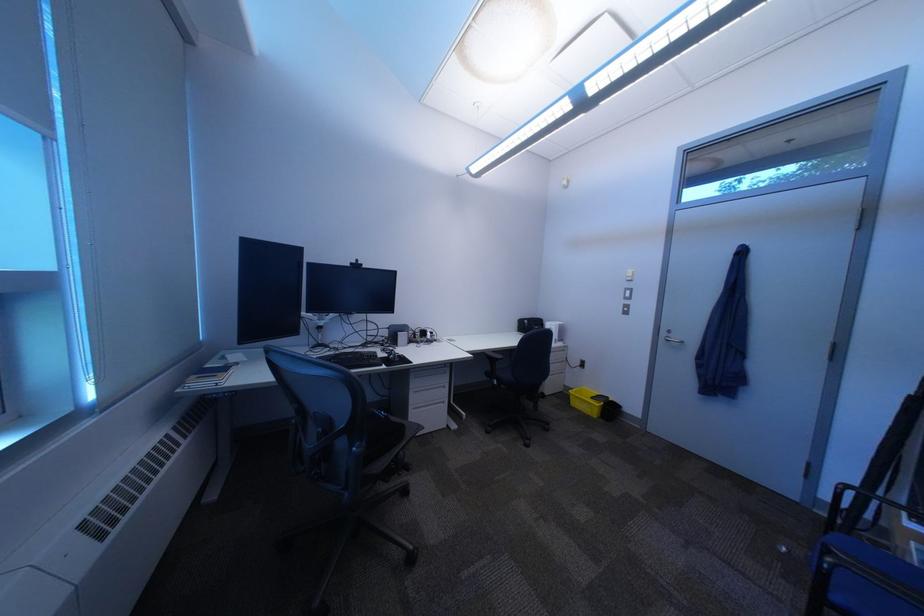
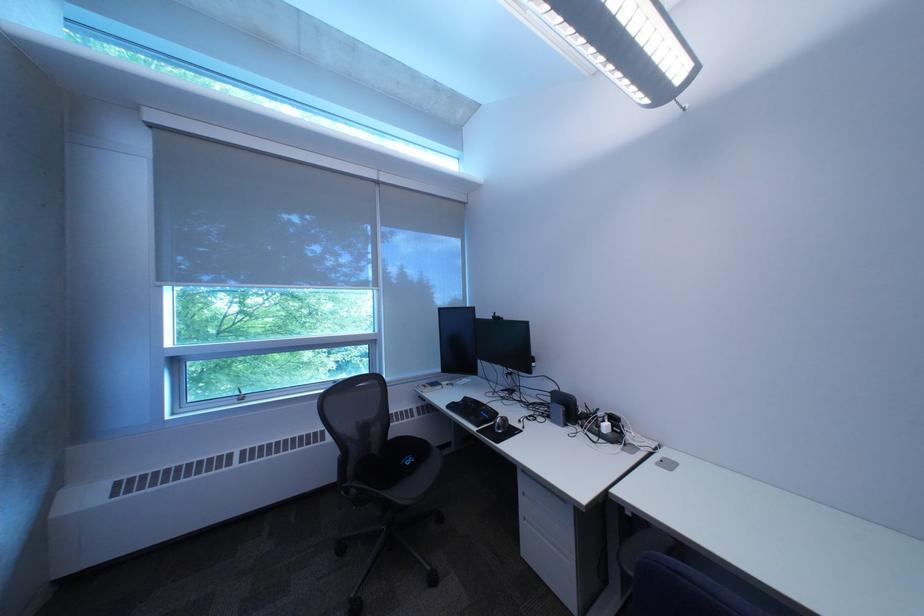
Find the pixel in the second image that matches point (396, 367) in the first image.

(492, 429)